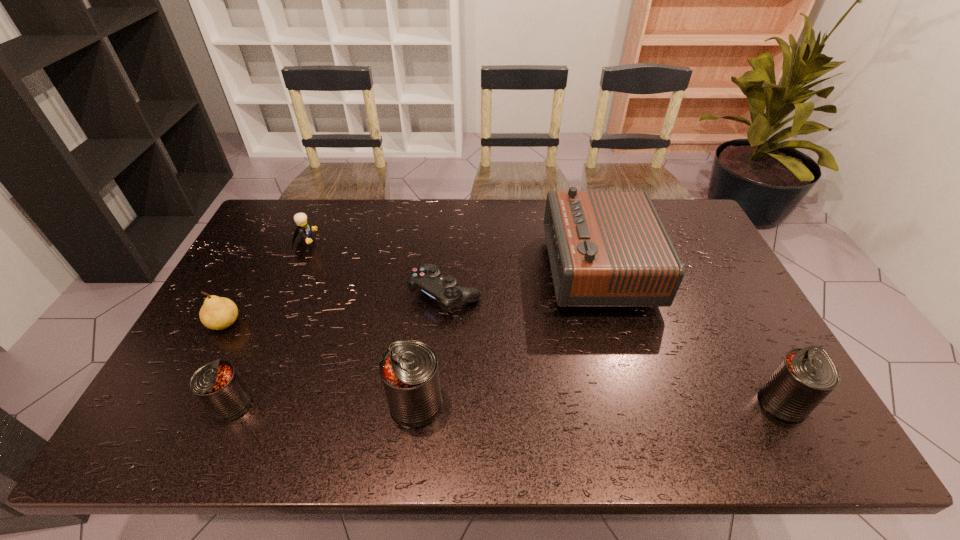
If equal spacing is the goal by inserting an additional can among them, please point out a vacant space for this new can. Please provide its 2D coordinates. Your answer should be formatted as a tuple, i.e. [(x, y)], where the tuple contains the x and y coordinates of a point satisfying the conditions above.

[(600, 403)]